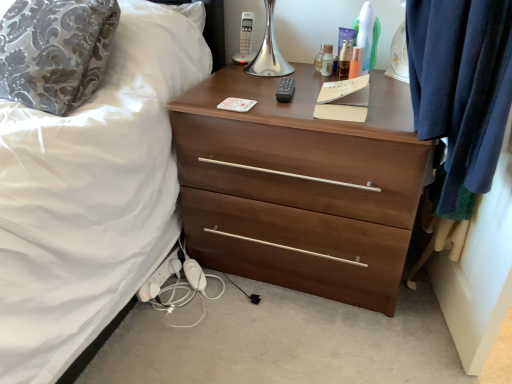
Locate an element on the screen. free space in front of black plastic remote at center is located at coordinates (287, 112).